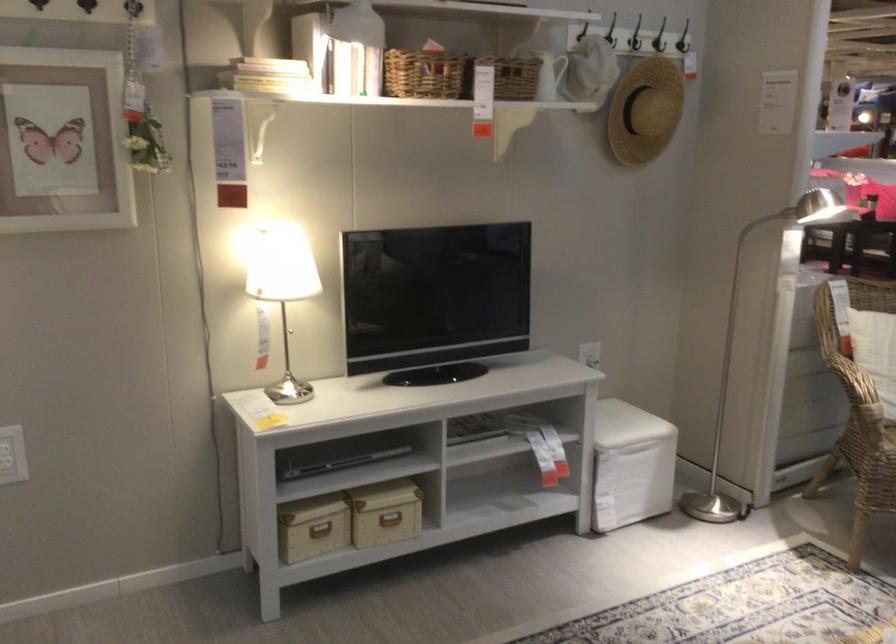
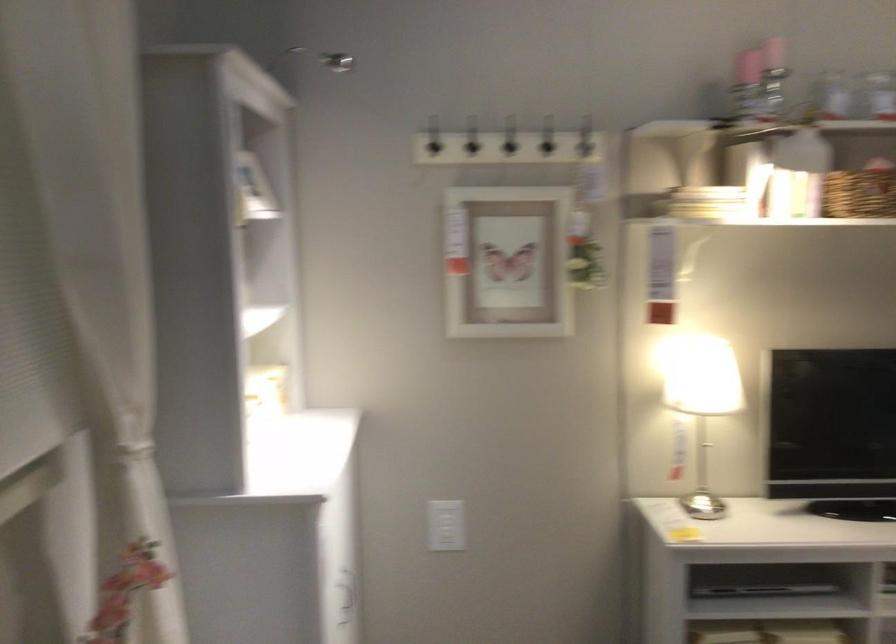
In the second image, find the point that corresponds to point (276, 292) in the first image.

(702, 402)